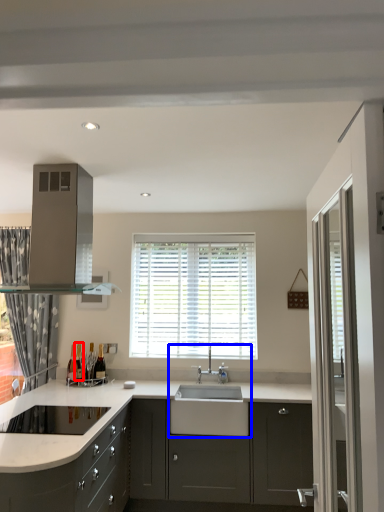
Question: Which of the following is the closest to the observer, wine bottle (highlighted by a red box) or sink (highlighted by a blue box)?

Choices:
 (A) wine bottle
 (B) sink

Answer: (B)